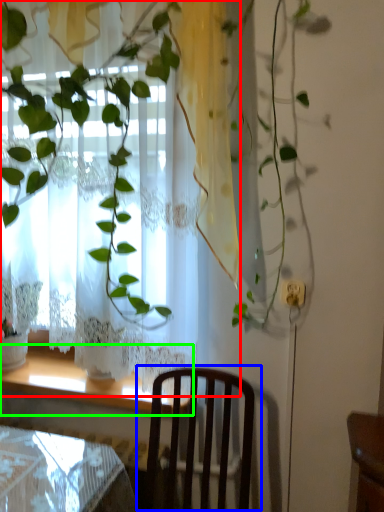
Question: Estimate the real-world distances between objects in this image. Which object is closer to curtain (highlighted by a red box), chair (highlighted by a blue box) or window sill (highlighted by a green box)?

Choices:
 (A) chair
 (B) window sill

Answer: (A)